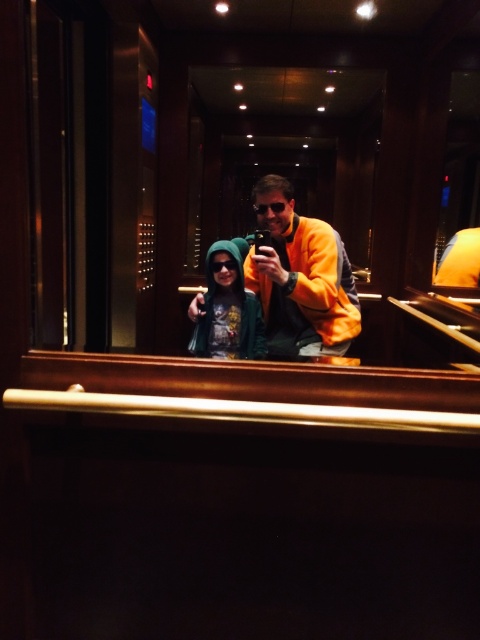
What do you see at coordinates (300, 276) in the screenshot?
I see `yellow fleece jacket at center` at bounding box center [300, 276].

Does yellow fleece jacket at center appear over green hoodie at center?

Correct, yellow fleece jacket at center is located above green hoodie at center.

Image resolution: width=480 pixels, height=640 pixels. Describe the element at coordinates (300, 276) in the screenshot. I see `yellow fleece jacket at center` at that location.

Find the location of a particular element. yellow fleece jacket at center is located at coordinates (300, 276).